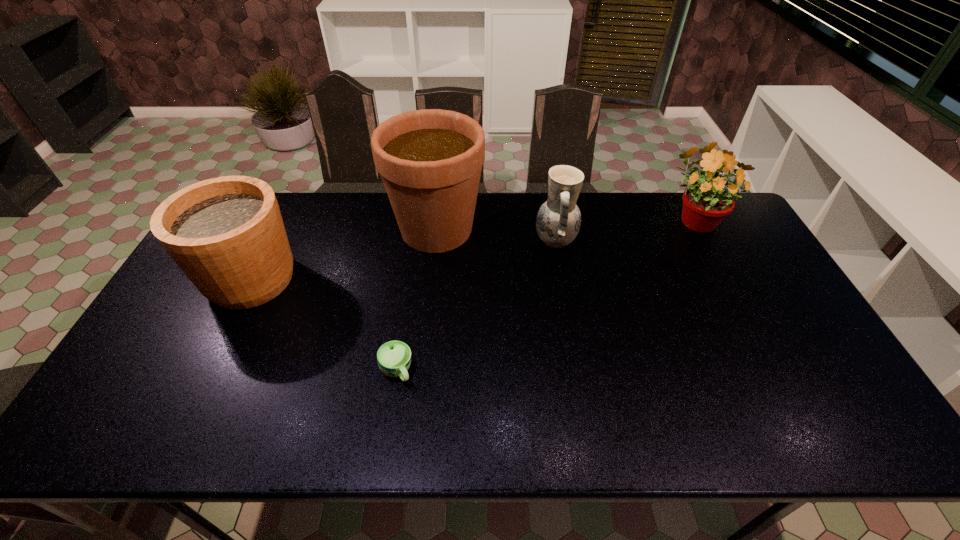
You are a GUI agent. You are given a task and a screenshot of the screen. Output one action in this format:
    pyautogui.click(x=<x>, y=<y>)
    Task: Click on the free spot between the tallest flowerpot and the second object from right to left
    The image size is (960, 540).
    Given the screenshot: What is the action you would take?
    pyautogui.click(x=495, y=235)

Where is `vacant space that's between the shortest object and the pottery`? The width and height of the screenshot is (960, 540). vacant space that's between the shortest object and the pottery is located at coordinates (476, 306).

Where is `empty space between the rightmost object and the second object from right to left`? empty space between the rightmost object and the second object from right to left is located at coordinates (624, 230).

The height and width of the screenshot is (540, 960). In order to click on free area in between the second flowerpot from right to left and the second object from right to left in this screenshot , I will do `click(495, 235)`.

This screenshot has width=960, height=540. Identify the location of free space between the fourth object from left to right and the nearest object. (x=476, y=306).

You are a GUI agent. You are given a task and a screenshot of the screen. Output one action in this format:
    pyautogui.click(x=<x>, y=<y>)
    Task: Click on the free point between the fourth object from left to right and the shortest object
    
    Given the screenshot: What is the action you would take?
    pyautogui.click(x=476, y=306)

Where is `free space between the rightmost flowerpot and the leftmost flowerpot`? This screenshot has height=540, width=960. free space between the rightmost flowerpot and the leftmost flowerpot is located at coordinates (472, 249).

Identify the location of blank region between the rightmost flowerpot and the cup. pos(545,294).

The width and height of the screenshot is (960, 540). In order to click on free spot between the nearest object and the fourth object from left to right in this screenshot , I will do click(476, 306).

Image resolution: width=960 pixels, height=540 pixels. What are the coordinates of `the third closest object relative to the rightmost object` in the screenshot? It's located at (394, 357).